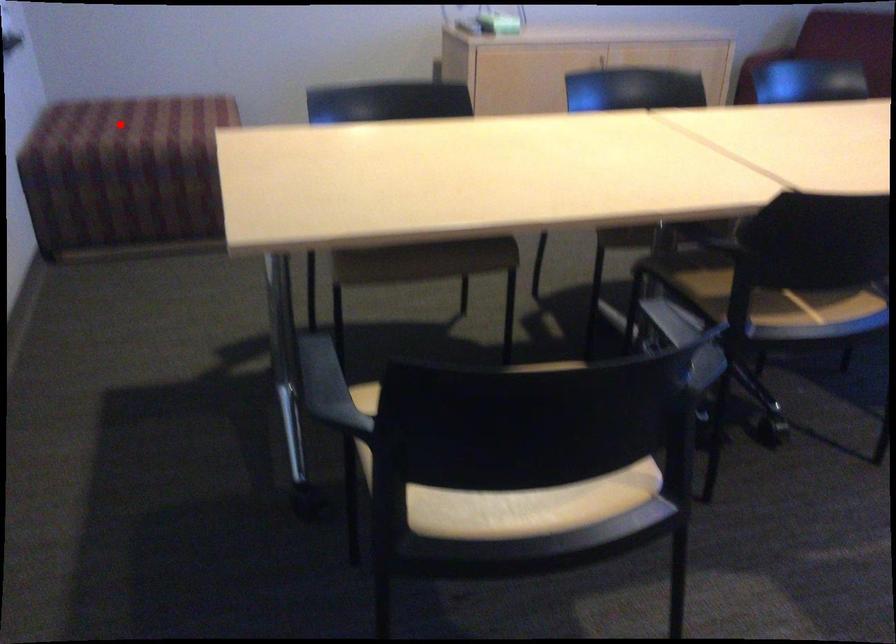
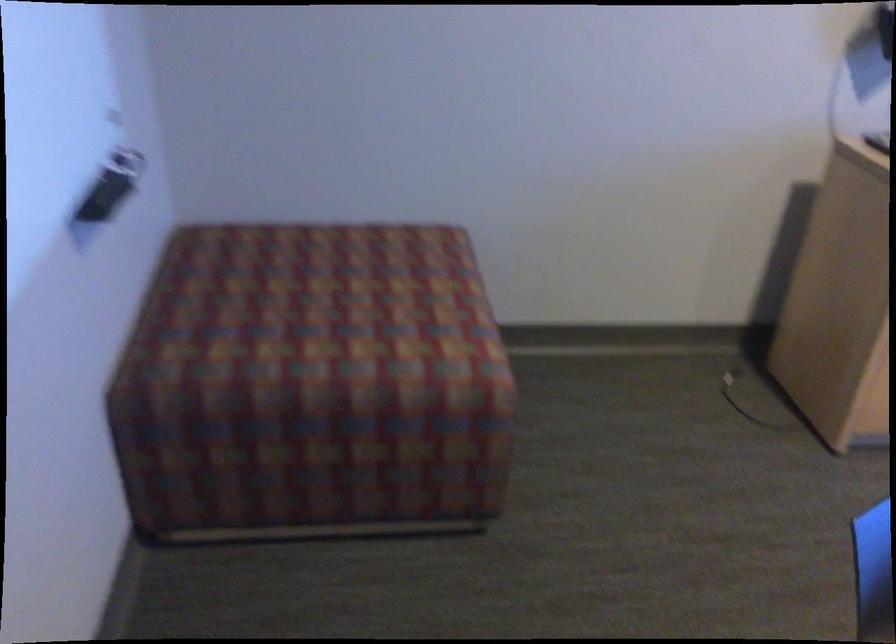
Question: I am providing you with two images of the same scene from different viewpoints. A red point is shown in image1. For the corresponding object point in image2, is it positioned nearer or farther from the camera?

Choices:
 (A) Nearer
 (B) Farther

Answer: (A)